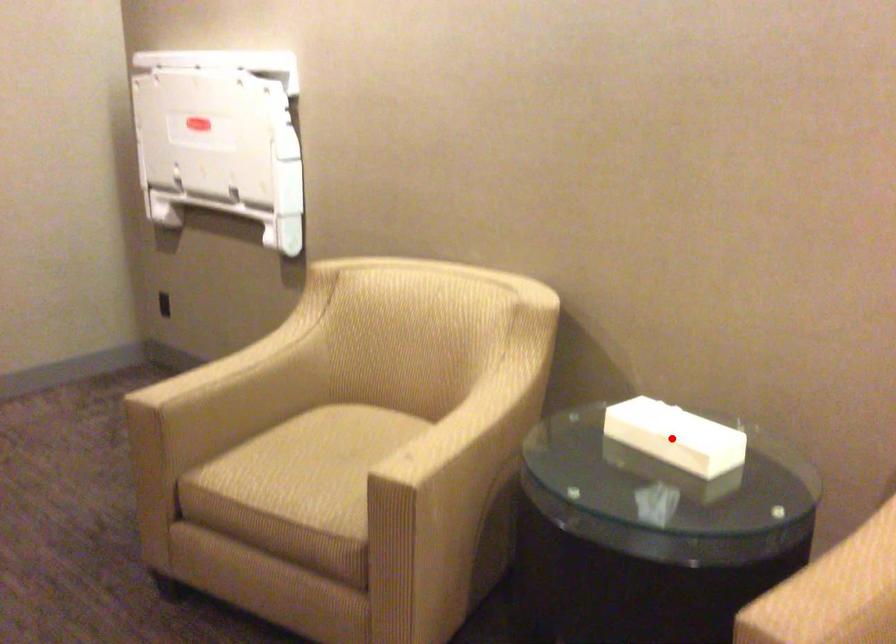
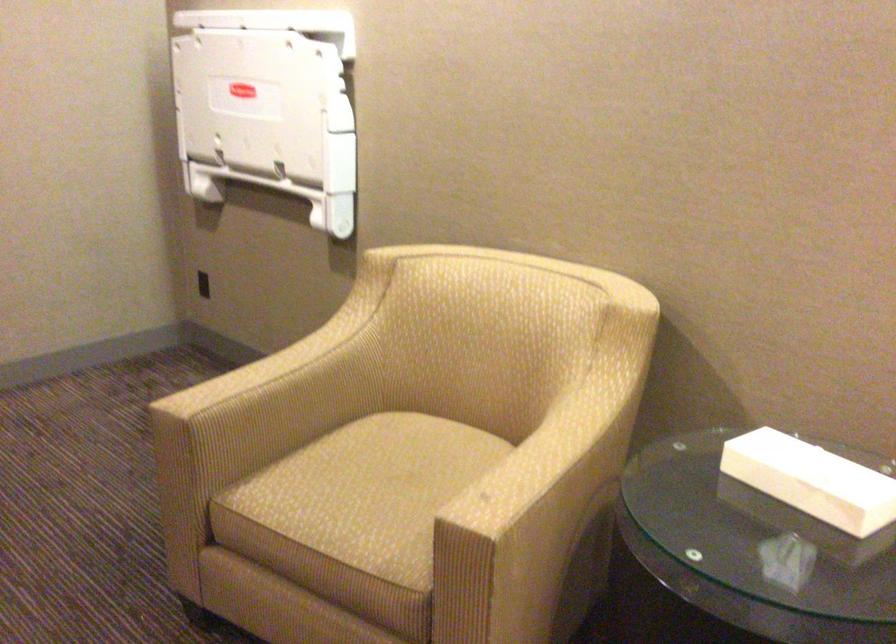
In the second image, find the point that corresponds to the highlighted location in the first image.

(812, 480)